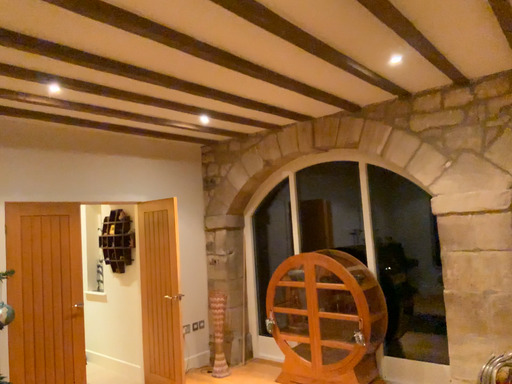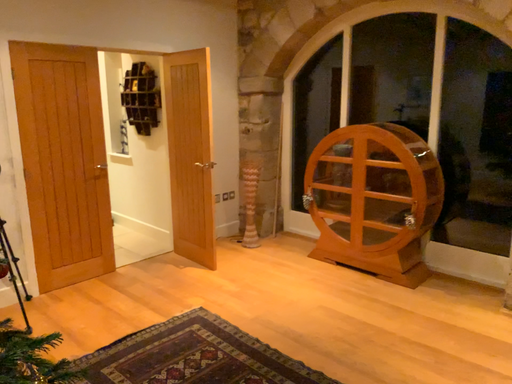
Question: How did the camera likely rotate when shooting the video?

Choices:
 (A) rotated downward
 (B) rotated upward

Answer: (A)